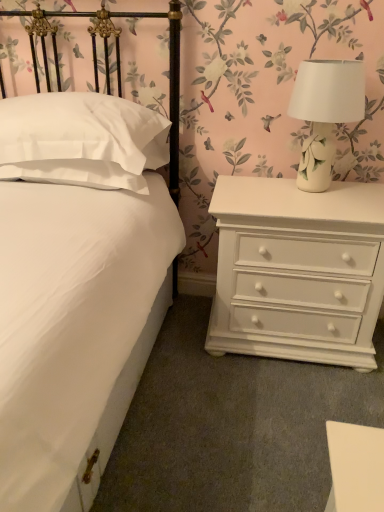
Question: From a real-world perspective, is white matte bed at center on top of white ceramic lamp at upper right?

Choices:
 (A) no
 (B) yes

Answer: (A)

Question: From the image's perspective, is white matte bed at center located above white ceramic lamp at upper right?

Choices:
 (A) yes
 (B) no

Answer: (B)

Question: Is white matte bed at center thinner than white ceramic lamp at upper right?

Choices:
 (A) no
 (B) yes

Answer: (A)

Question: Can white ceramic lamp at upper right be found inside white matte bed at center?

Choices:
 (A) no
 (B) yes

Answer: (A)

Question: Are white matte bed at center and white ceramic lamp at upper right making contact?

Choices:
 (A) yes
 (B) no

Answer: (B)

Question: From the image's perspective, is white painted wood chest of drawers at right above or below white satin pillow at left?

Choices:
 (A) below
 (B) above

Answer: (A)

Question: Is point pos(233,244) closer or farther from the camera than point pos(147,130)?

Choices:
 (A) farther
 (B) closer

Answer: (B)

Question: From a real-world perspective, is white painted wood chest of drawers at right positioned above or below white satin pillow at left?

Choices:
 (A) above
 (B) below

Answer: (B)

Question: Is white painted wood chest of drawers at right inside the boundaries of white satin pillow at left, or outside?

Choices:
 (A) outside
 (B) inside

Answer: (A)

Question: Considering the relative positions of white satin pillow at left and white painted wood chest of drawers at right in the image provided, is white satin pillow at left to the left or to the right of white painted wood chest of drawers at right?

Choices:
 (A) left
 (B) right

Answer: (A)

Question: Does point (24, 152) appear closer or farther from the camera than point (332, 306)?

Choices:
 (A) farther
 (B) closer

Answer: (B)

Question: Considering their positions, is white satin pillow at left located in front of or behind white painted wood chest of drawers at right?

Choices:
 (A) behind
 (B) front

Answer: (B)

Question: In terms of width, does white satin pillow at left look wider or thinner when compared to white painted wood chest of drawers at right?

Choices:
 (A) wide
 (B) thin

Answer: (A)

Question: Looking at the image, does white matte bed at center seem bigger or smaller compared to white ceramic lamp at upper right?

Choices:
 (A) big
 (B) small

Answer: (A)

Question: From a real-world perspective, is white matte bed at center physically located above or below white ceramic lamp at upper right?

Choices:
 (A) above
 (B) below

Answer: (B)